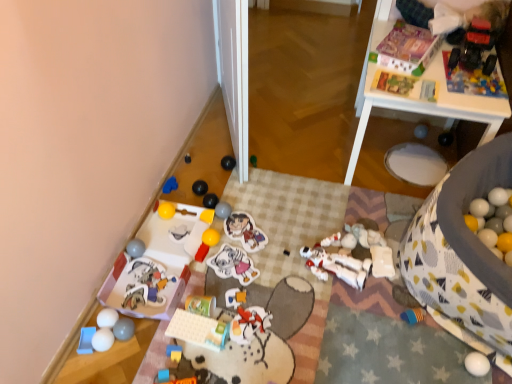
Find the location of a particular element. vacant area that lies in front of rubber ball at center, the tenth toy when ordered from right to left is located at coordinates tap(224, 250).